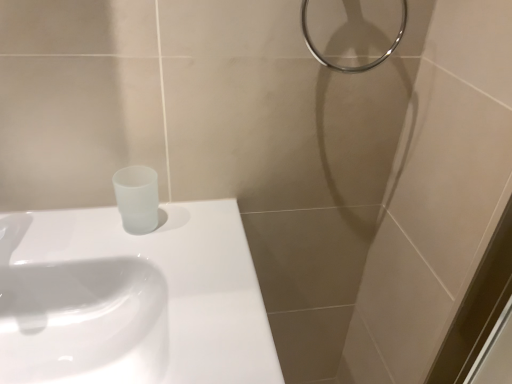
What do you see at coordinates (83, 322) in the screenshot? I see `white glossy sink at upper left, acting as the 2th sink starting from the top` at bounding box center [83, 322].

The width and height of the screenshot is (512, 384). What are the coordinates of `white glossy sink at lower left, positioned as the 2th sink in bottom-to-top order` in the screenshot? It's located at (132, 299).

Identify the location of metallic ring at upper right. The width and height of the screenshot is (512, 384). (358, 66).

From a real-world perspective, is white glossy sink at upper left, acting as the 2th sink starting from the top, physically located above or below white glossy sink at lower left, marked as the first sink in a top-to-bottom arrangement?

In terms of real-world spatial position, white glossy sink at upper left, acting as the 2th sink starting from the top, is below white glossy sink at lower left, marked as the first sink in a top-to-bottom arrangement.

Do you think white glossy sink at upper left, acting as the 2th sink starting from the top, is within white glossy sink at lower left, positioned as the 2th sink in bottom-to-top order, or outside of it?

white glossy sink at upper left, acting as the 2th sink starting from the top, cannot be found inside white glossy sink at lower left, positioned as the 2th sink in bottom-to-top order.

Between point (120, 280) and point (148, 297), which one is positioned in front?

The point (148, 297) is closer to the camera.

Considering the sizes of white glossy sink at upper left, acting as the 2th sink starting from the top, and white glossy sink at lower left, marked as the first sink in a top-to-bottom arrangement, in the image, is white glossy sink at upper left, acting as the 2th sink starting from the top, wider or thinner than white glossy sink at lower left, marked as the first sink in a top-to-bottom arrangement,?

Considering their sizes, white glossy sink at upper left, acting as the 2th sink starting from the top, looks slimmer than white glossy sink at lower left, marked as the first sink in a top-to-bottom arrangement.

Is point (335, 70) less distant than point (138, 267)?

No, (335, 70) is further to viewer.

From the image's perspective, is metallic ring at upper right under white glossy sink at upper left, the 1th sink when ordered from bottom to top?

No.

Based on the photo, is metallic ring at upper right positioned with its back to white glossy sink at upper left, acting as the 2th sink starting from the top?

No, metallic ring at upper right is not facing away from white glossy sink at upper left, acting as the 2th sink starting from the top.

In terms of width, does metallic ring at upper right look wider or thinner when compared to white glossy sink at upper left, acting as the 2th sink starting from the top?

Considering their sizes, metallic ring at upper right looks slimmer than white glossy sink at upper left, acting as the 2th sink starting from the top.

Does white glossy sink at upper left, acting as the 2th sink starting from the top, have a smaller size compared to metallic ring at upper right?

No, white glossy sink at upper left, acting as the 2th sink starting from the top, is not smaller than metallic ring at upper right.

From the image's perspective, is white glossy sink at upper left, acting as the 2th sink starting from the top, over metallic ring at upper right?

No, from the image's perspective, white glossy sink at upper left, acting as the 2th sink starting from the top, is not above metallic ring at upper right.

What's the angular difference between white glossy sink at upper left, acting as the 2th sink starting from the top, and metallic ring at upper right's facing directions?

The angular difference between white glossy sink at upper left, acting as the 2th sink starting from the top, and metallic ring at upper right is 0.776 degrees.

From the picture: Can you confirm if white glossy sink at lower left, positioned as the 2th sink in bottom-to-top order, is positioned to the right of white glossy sink at upper left, the 1th sink when ordered from bottom to top?

Indeed, white glossy sink at lower left, positioned as the 2th sink in bottom-to-top order, is positioned on the right side of white glossy sink at upper left, the 1th sink when ordered from bottom to top.

Between point (60, 247) and point (35, 280), which one is positioned behind?

Point (35, 280)

How much distance is there between white glossy sink at lower left, positioned as the 2th sink in bottom-to-top order, and white glossy sink at upper left, acting as the 2th sink starting from the top?

white glossy sink at lower left, positioned as the 2th sink in bottom-to-top order, is 1.25 inches away from white glossy sink at upper left, acting as the 2th sink starting from the top.

Who is bigger, white glossy sink at lower left, positioned as the 2th sink in bottom-to-top order, or white glossy sink at upper left, the 1th sink when ordered from bottom to top?

white glossy sink at upper left, the 1th sink when ordered from bottom to top.

How many degrees apart are the facing directions of metallic ring at upper right and white glossy sink at lower left, marked as the first sink in a top-to-bottom arrangement?

They differ by 0.444 degrees in their facing directions.

Considering the positions of point (309, 47) and point (229, 226), is point (309, 47) closer or farther from the camera than point (229, 226)?

Clearly, point (309, 47) is closer to the camera than point (229, 226).

Could white glossy sink at lower left, marked as the first sink in a top-to-bottom arrangement, be considered to be inside metallic ring at upper right?

Actually, white glossy sink at lower left, marked as the first sink in a top-to-bottom arrangement, is outside metallic ring at upper right.

Based on the photo, which is more to the right, metallic ring at upper right or white glossy sink at lower left, marked as the first sink in a top-to-bottom arrangement?

metallic ring at upper right.

From a real-world perspective, is white glossy sink at lower left, marked as the first sink in a top-to-bottom arrangement, physically located above or below metallic ring at upper right?

Clearly, from a real-world perspective, white glossy sink at lower left, marked as the first sink in a top-to-bottom arrangement, is below metallic ring at upper right.

In order to click on the 1st sink below the metallic ring at upper right (from the image's perspective) in this screenshot , I will do `click(132, 299)`.

From the picture: Considering the relative positions of white glossy sink at lower left, marked as the first sink in a top-to-bottom arrangement, and metallic ring at upper right in the image provided, is white glossy sink at lower left, marked as the first sink in a top-to-bottom arrangement, to the left of metallic ring at upper right from the viewer's perspective?

Indeed, white glossy sink at lower left, marked as the first sink in a top-to-bottom arrangement, is positioned on the left side of metallic ring at upper right.

Find the location of `sink that appears above the white glossy sink at upper left, the 1th sink when ordered from bottom to top (from a real-world perspective)`. sink that appears above the white glossy sink at upper left, the 1th sink when ordered from bottom to top (from a real-world perspective) is located at coordinates (132, 299).

Find the location of a particular element. The image size is (512, 384). shower located on the right of white glossy sink at upper left, the 1th sink when ordered from bottom to top is located at coordinates (358, 66).

From the image, which object appears to be nearer to metallic ring at upper right, white glossy sink at upper left, acting as the 2th sink starting from the top, or white glossy sink at lower left, positioned as the 2th sink in bottom-to-top order?

Based on the image, white glossy sink at lower left, positioned as the 2th sink in bottom-to-top order, appears to be nearer to metallic ring at upper right.

Considering their positions, is white glossy sink at lower left, positioned as the 2th sink in bottom-to-top order, positioned further to white glossy sink at upper left, acting as the 2th sink starting from the top, than metallic ring at upper right?

metallic ring at upper right is further to white glossy sink at upper left, acting as the 2th sink starting from the top.

Estimate the real-world distances between objects in this image. Which object is closer to metallic ring at upper right, white glossy sink at lower left, positioned as the 2th sink in bottom-to-top order, or white glossy sink at upper left, acting as the 2th sink starting from the top?

white glossy sink at lower left, positioned as the 2th sink in bottom-to-top order, lies closer to metallic ring at upper right than the other object.

Estimate the real-world distances between objects in this image. Which object is closer to white glossy sink at lower left, positioned as the 2th sink in bottom-to-top order, metallic ring at upper right or white glossy sink at upper left, the 1th sink when ordered from bottom to top?

Based on the image, white glossy sink at upper left, the 1th sink when ordered from bottom to top, appears to be nearer to white glossy sink at lower left, positioned as the 2th sink in bottom-to-top order.

Which object lies nearer to the anchor point white glossy sink at upper left, the 1th sink when ordered from bottom to top, metallic ring at upper right or white glossy sink at lower left, marked as the first sink in a top-to-bottom arrangement?

white glossy sink at lower left, marked as the first sink in a top-to-bottom arrangement, is positioned closer to the anchor white glossy sink at upper left, the 1th sink when ordered from bottom to top.

When comparing their distances from white glossy sink at lower left, positioned as the 2th sink in bottom-to-top order, does white glossy sink at upper left, the 1th sink when ordered from bottom to top, or metallic ring at upper right seem further?

A: Among the two, metallic ring at upper right is located further to white glossy sink at lower left, positioned as the 2th sink in bottom-to-top order.

Locate an element on the screen. sink that lies between metallic ring at upper right and white glossy sink at upper left, acting as the 2th sink starting from the top, from top to bottom is located at coordinates (132, 299).